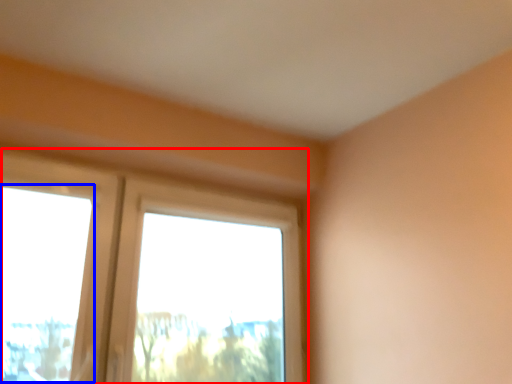
Question: Which point is further to the camera, window (highlighted by a red box) or window screen (highlighted by a blue box)?

Choices:
 (A) window
 (B) window screen

Answer: (A)